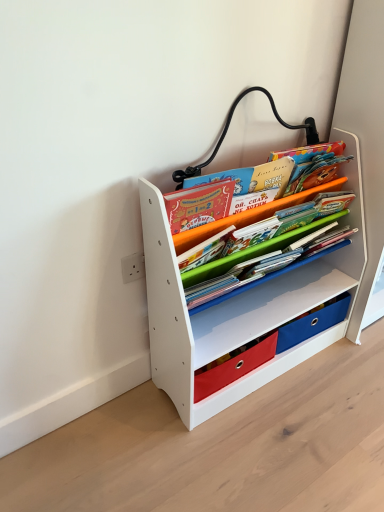
Measure the distance between point [159,278] and camera.

Point [159,278] and camera are 3.79 feet apart from each other.

What is the approximate height of white matte bookshelf at center?

white matte bookshelf at center is 35.46 inches tall.

The image size is (384, 512). Describe the element at coordinates (237, 305) in the screenshot. I see `white matte bookshelf at center` at that location.

The image size is (384, 512). In order to click on white matte bookshelf at center in this screenshot , I will do `click(237, 305)`.

What do you see at coordinates (247, 216) in the screenshot? I see `matte paper book at center` at bounding box center [247, 216].

Measure the distance between point [332,184] and camera.

They are 1.28 meters apart.

In order to click on matte paper book at center in this screenshot , I will do `click(247, 216)`.

The image size is (384, 512). Find the location of `white matte bookshelf at center`. white matte bookshelf at center is located at coordinates (237, 305).

Which is more to the left, matte paper book at center or white matte bookshelf at center?

From the viewer's perspective, matte paper book at center appears more on the left side.

Which object is further away from the camera taking this photo, matte paper book at center or white matte bookshelf at center?

matte paper book at center is further away from the camera.

Does point (267, 247) lie behind point (276, 372)?

No, (267, 247) is in front of (276, 372).

From the image's perspective, between matte paper book at center and white matte bookshelf at center, who is located below?

white matte bookshelf at center.

From a real-world perspective, is matte paper book at center on top of white matte bookshelf at center?

Indeed, from a real-world perspective, matte paper book at center stands above white matte bookshelf at center.

Looking at their sizes, would you say matte paper book at center is wider or thinner than white matte bookshelf at center?

Clearly, matte paper book at center has less width compared to white matte bookshelf at center.

Is matte paper book at center shorter than white matte bookshelf at center?

Yes.

Can you confirm if matte paper book at center is smaller than white matte bookshelf at center?

Correct, matte paper book at center occupies less space than white matte bookshelf at center.

Is white matte bookshelf at center located within matte paper book at center?

No, matte paper book at center does not contain white matte bookshelf at center.

Is there a large distance between matte paper book at center and white matte bookshelf at center?

No, matte paper book at center is not far away from white matte bookshelf at center.

Is matte paper book at center turned away from white matte bookshelf at center?

Absolutely, matte paper book at center is directed away from white matte bookshelf at center.

Can you tell me how much matte paper book at center and white matte bookshelf at center differ in facing direction?

0.946 degrees.

How far apart are matte paper book at center and white matte bookshelf at center?

They are 18.90 centimeters apart.

Identify the location of book that appears above the white matte bookshelf at center (from a real-world perspective). This screenshot has width=384, height=512. (247, 216).

Considering the relative positions of white matte bookshelf at center and matte paper book at center in the image provided, is white matte bookshelf at center to the left of matte paper book at center from the viewer's perspective?

No, white matte bookshelf at center is not to the left of matte paper book at center.

Is white matte bookshelf at center in front of or behind matte paper book at center in the image?

white matte bookshelf at center is in front of matte paper book at center.

Does point (360, 208) lie in front of point (242, 213)?

No, it is not.

From the image's perspective, is white matte bookshelf at center above matte paper book at center?

No.

From a real-world perspective, is white matte bookshelf at center under matte paper book at center?

Yes.

Does white matte bookshelf at center have a lesser width compared to matte paper book at center?

In fact, white matte bookshelf at center might be wider than matte paper book at center.

Who is shorter, white matte bookshelf at center or matte paper book at center?

With less height is matte paper book at center.

Based on their sizes in the image, would you say white matte bookshelf at center is bigger or smaller than matte paper book at center?

Clearly, white matte bookshelf at center is larger in size than matte paper book at center.

Is white matte bookshelf at center situated inside matte paper book at center or outside?

white matte bookshelf at center is spatially situated outside matte paper book at center.

Is white matte bookshelf at center not near matte paper book at center?

No, there isn't a large distance between white matte bookshelf at center and matte paper book at center.

Is matte paper book at center at the back of white matte bookshelf at center?

Yes, white matte bookshelf at center is positioned with its back facing matte paper book at center.

What's the angular difference between white matte bookshelf at center and matte paper book at center's facing directions?

There is a 0.946-degree angle between the facing directions of white matte bookshelf at center and matte paper book at center.

How distant is white matte bookshelf at center from matte paper book at center?

They are 18.90 centimeters apart.

I want to click on book on the left of the white matte bookshelf at center, so click(247, 216).

Where is `shelf on the right of matte paper book at center`? shelf on the right of matte paper book at center is located at coordinates (237, 305).

The width and height of the screenshot is (384, 512). Identify the location of shelf below the matte paper book at center (from a real-world perspective). (237, 305).